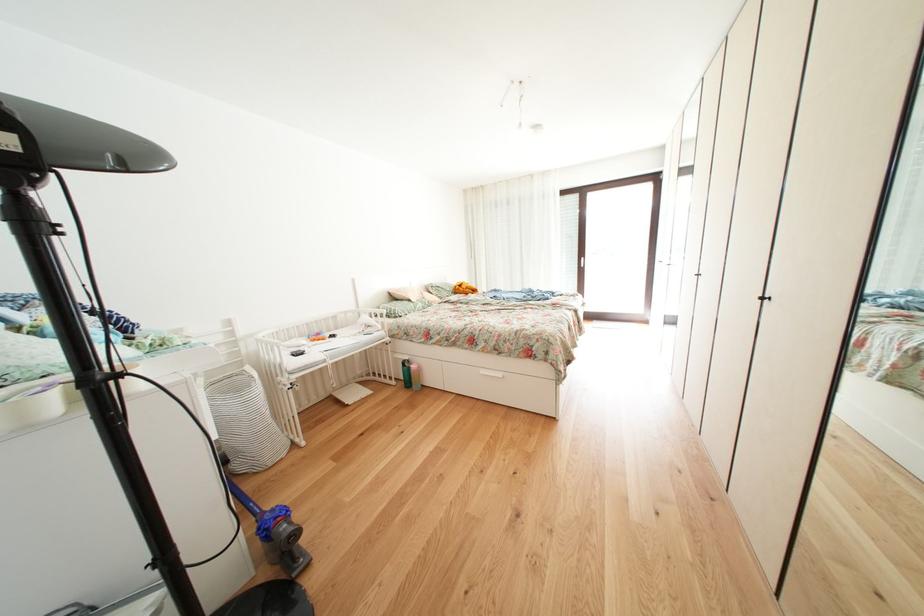
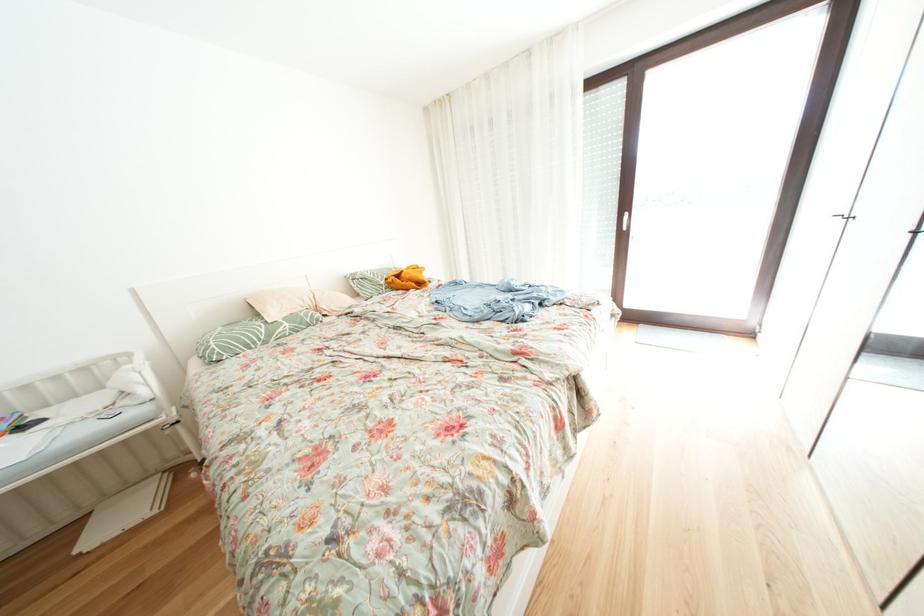
In a continuous first-person perspective shot, in which direction is the camera moving?

The cameraman moved toward right, forward.